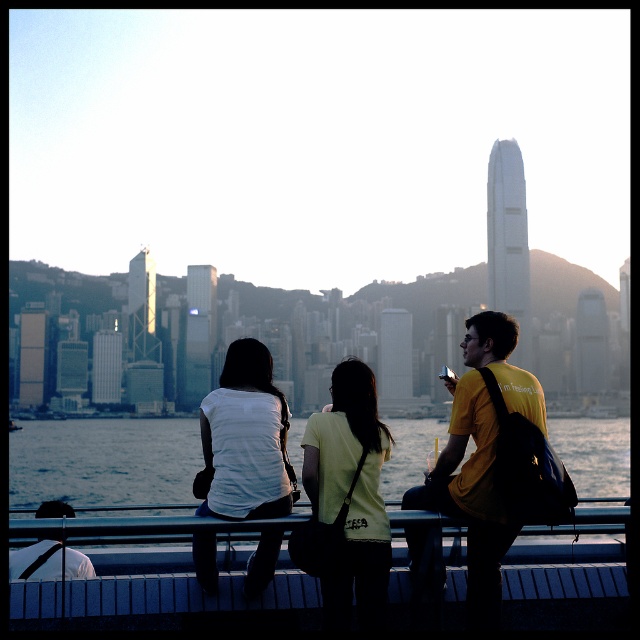
Question: Considering the real-world distances, which object is farthest from the white matte shirt at center?

Choices:
 (A) blue water at center
 (B) light yellow t-shirt at center

Answer: (A)

Question: Which of these objects is positioned closest to the matte yellow t-shirt at center?

Choices:
 (A) blue water at center
 (B) white matte shirt at center
 (C) light yellow t-shirt at center

Answer: (C)

Question: Can you confirm if light yellow t-shirt at center is positioned below white matte shirt at center?

Choices:
 (A) yes
 (B) no

Answer: (A)

Question: Which point is farther to the camera?

Choices:
 (A) light yellow t-shirt at center
 (B) matte yellow t-shirt at center

Answer: (A)

Question: Can you confirm if matte yellow t-shirt at center is positioned to the right of blue water at center?

Choices:
 (A) yes
 (B) no

Answer: (A)

Question: Can you confirm if matte yellow t-shirt at center is positioned to the right of blue water at center?

Choices:
 (A) yes
 (B) no

Answer: (A)